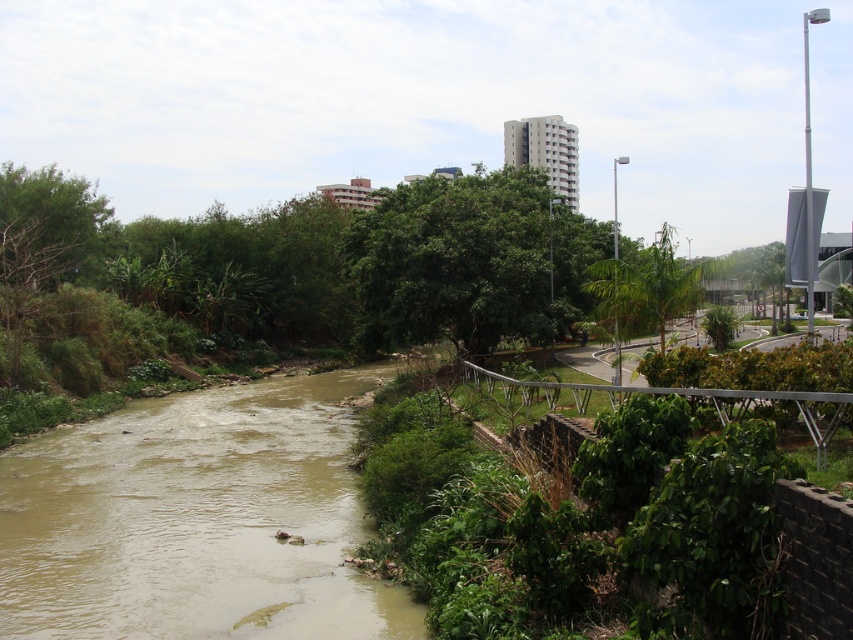
You are an urban planner analyzing the river area. You need to determine which area is larger in the image between the brown muddy water at center and the green leafy tree at center. Which one is larger?

The green leafy tree at center is larger than the brown muddy water at center because the brown muddy water at center occupies less space than the green leafy tree at center.

You are a city planner reviewing this area. You need to determine if the brown muddy water at center is located beneath the green leafy tree at center. Based on the scene description, can you confirm this relationship?

The brown muddy water at center is positioned under green leafy tree at center, so yes, the brown muddy water at center is indeed located beneath the green leafy tree at center.

You are a park visitor standing on the paved pathway near the low brick wall and metal railing on the right side of the river. You want to take a photo of the green leafy tree at center and the brown muddy water at center. Which object should you focus on first if you want to capture both in one frame without moving your camera?

You should focus on the green leafy tree at center first because the brown muddy water at center is to the left of it, so by centering the tree in your frame, the water will naturally be included to its left side without needing to adjust the camera position.